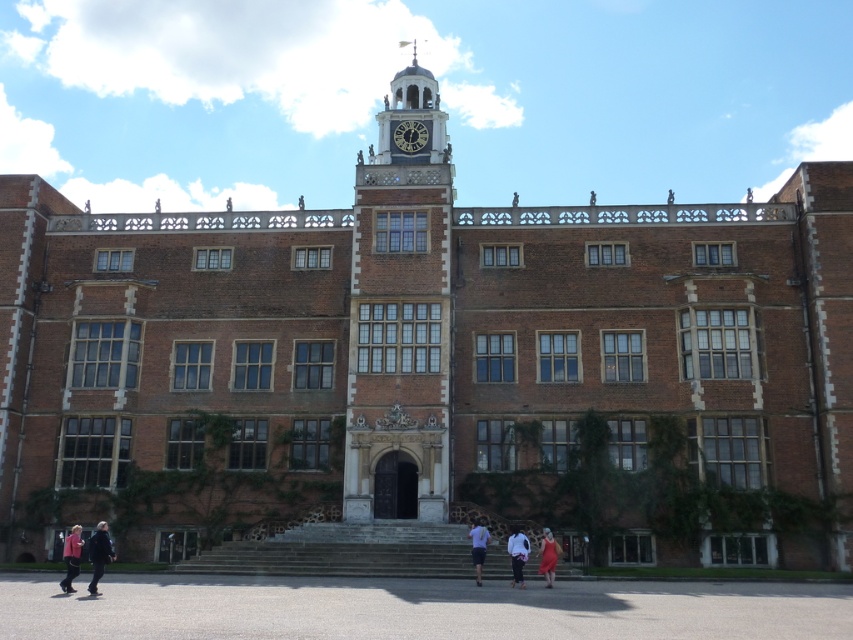
Is dark blue jacket at lower left behind white cotton shirt at center?

No, dark blue jacket at lower left is in front of white cotton shirt at center.

At what (x,y) coordinates should I click in order to perform the action: click on dark blue jacket at lower left. Please return your answer as a coordinate pair (x, y). The image size is (853, 640). Looking at the image, I should click on (99, 554).

Does point (90, 586) come closer to viewer compared to point (514, 564)?

No.

Identify the location of dark blue jacket at lower left. This screenshot has height=640, width=853. (99, 554).

Is pink fabric at lower left wider than white cotton shirt at center?

Yes.

Is pink fabric at lower left further to camera compared to white cotton shirt at center?

That is True.

Image resolution: width=853 pixels, height=640 pixels. What are the coordinates of `pink fabric at lower left` in the screenshot? It's located at (71, 557).

Between pink fabric at lower left and light blue shirt at center, which one has less height?

light blue shirt at center

Describe the element at coordinates (71, 557) in the screenshot. I see `pink fabric at lower left` at that location.

Find the location of a particular element. The image size is (853, 640). pink fabric at lower left is located at coordinates (71, 557).